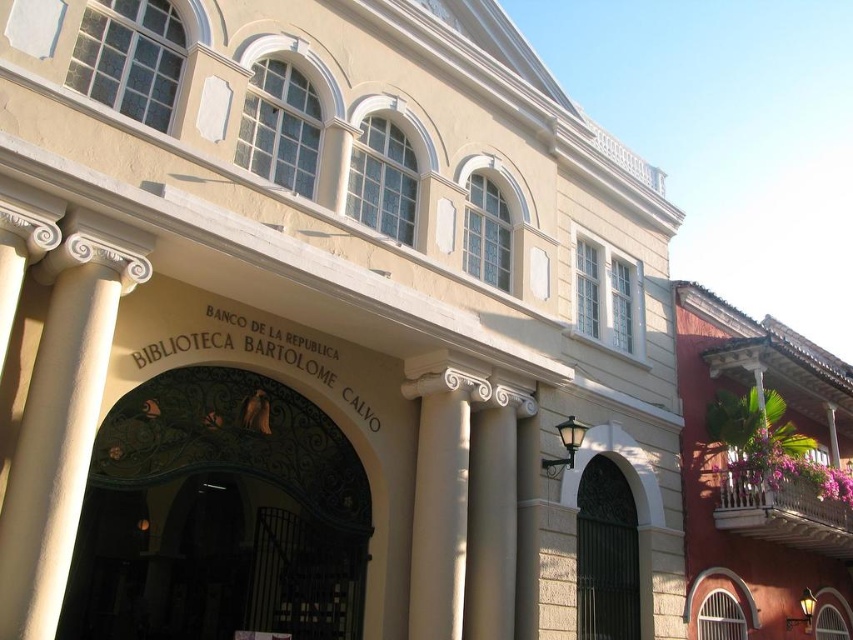
Question: Which of the following is the closest to the observer?

Choices:
 (A) (473, 605)
 (B) (45, 452)
 (C) (86, 488)

Answer: (B)

Question: Among these points, which one is nearest to the camera?

Choices:
 (A) (102, 300)
 (B) (610, 525)
 (C) (445, 490)
 (D) (466, 536)

Answer: (A)

Question: Which point appears farthest from the camera in this image?

Choices:
 (A) (492, 602)
 (B) (202, 368)
 (C) (415, 387)
 (D) (56, 253)

Answer: (C)

Question: Can you confirm if white glossy column at center is positioned to the left of dark metal gate at center?

Choices:
 (A) yes
 (B) no

Answer: (A)

Question: Does green wrought iron arch at center appear over white glossy column at center?

Choices:
 (A) no
 (B) yes

Answer: (A)

Question: Is green wrought iron arch at center to the right of white marble column at center from the viewer's perspective?

Choices:
 (A) yes
 (B) no

Answer: (B)